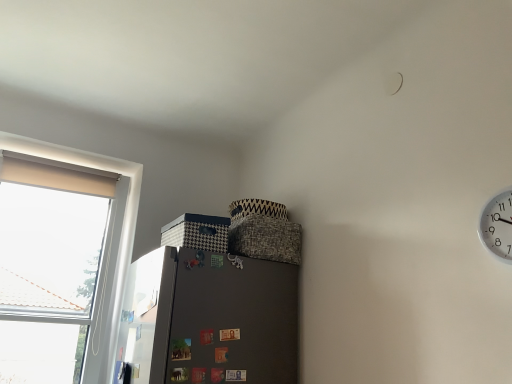
Question: Can you see white fabric window at left touching metallic silver screen door at left?

Choices:
 (A) no
 (B) yes

Answer: (A)

Question: Is white fabric window at left to the right of metallic silver screen door at left from the viewer's perspective?

Choices:
 (A) yes
 (B) no

Answer: (B)

Question: From the image's perspective, would you say white fabric window at left is positioned over metallic silver screen door at left?

Choices:
 (A) no
 (B) yes

Answer: (B)

Question: Is white fabric window at left positioned beyond the bounds of metallic silver screen door at left?

Choices:
 (A) no
 (B) yes

Answer: (B)

Question: Does white fabric window at left have a larger size compared to metallic silver screen door at left?

Choices:
 (A) yes
 (B) no

Answer: (A)

Question: From their relative heights in the image, would you say metallic silver screen door at left is taller or shorter than white plastic clock at upper right?

Choices:
 (A) tall
 (B) short

Answer: (A)

Question: From a real-world perspective, relative to white plastic clock at upper right, is metallic silver screen door at left vertically above or below?

Choices:
 (A) above
 (B) below

Answer: (B)

Question: In terms of width, does metallic silver screen door at left look wider or thinner when compared to white plastic clock at upper right?

Choices:
 (A) thin
 (B) wide

Answer: (A)

Question: Based on their positions, is metallic silver screen door at left located to the left or right of white plastic clock at upper right?

Choices:
 (A) right
 (B) left

Answer: (B)

Question: In terms of height, does white fabric window at left look taller or shorter compared to white plastic clock at upper right?

Choices:
 (A) tall
 (B) short

Answer: (A)

Question: Is white fabric window at left in front of or behind white plastic clock at upper right in the image?

Choices:
 (A) behind
 (B) front

Answer: (A)

Question: From a real-world perspective, is white fabric window at left above or below white plastic clock at upper right?

Choices:
 (A) below
 (B) above

Answer: (B)

Question: Considering the positions of point (17, 165) and point (480, 230), is point (17, 165) closer or farther from the camera than point (480, 230)?

Choices:
 (A) closer
 (B) farther

Answer: (B)

Question: Is point (508, 261) positioned closer to the camera than point (148, 357)?

Choices:
 (A) farther
 (B) closer

Answer: (B)

Question: In the image, is white plastic clock at upper right on the left side or the right side of metallic silver screen door at left?

Choices:
 (A) left
 (B) right

Answer: (B)